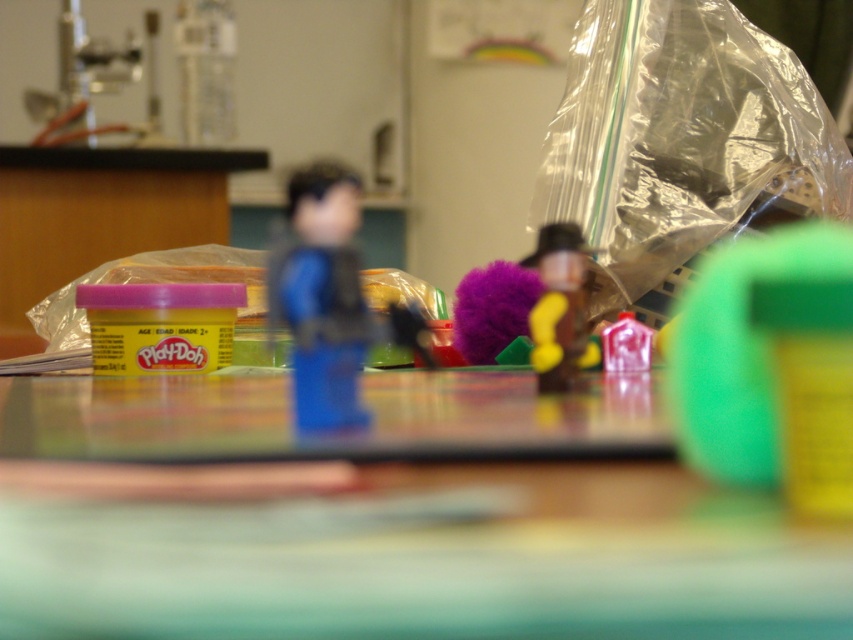
You are a student sitting at the table in the classroom scene. You need to place a sticker exactly halfway between the two points marked on the table. Which point is closer to the sticker? The sticker is placed at the midpoint between point (x=608, y=396) and point (x=561, y=225). Which of the two points is closer to the sticker?

Both points are equidistant from the midpoint, so neither is closer. The sticker is exactly halfway between point (x=608, y=396) and point (x=561, y=225).

Based on the photo, you are organizing a classroom and need to place the transparent plastic bag at right and the blue plastic figure at center into a storage box. The box has a maximum depth of 1.5 meters. Can both items fit in the box if placed end to end?

The transparent plastic bag at right is 1.74 meters from blue plastic figure at center, which exceeds the box depth of 1.5 meters. Therefore, both items cannot fit in the box when placed end to end.

You are a student looking at the Play Doh container and the two points marked on the table. Which point is closer to you, point (682, 220) or point (578, 307)?

Point (578, 307) is closer to you because it is less further to the camera than point (682, 220).